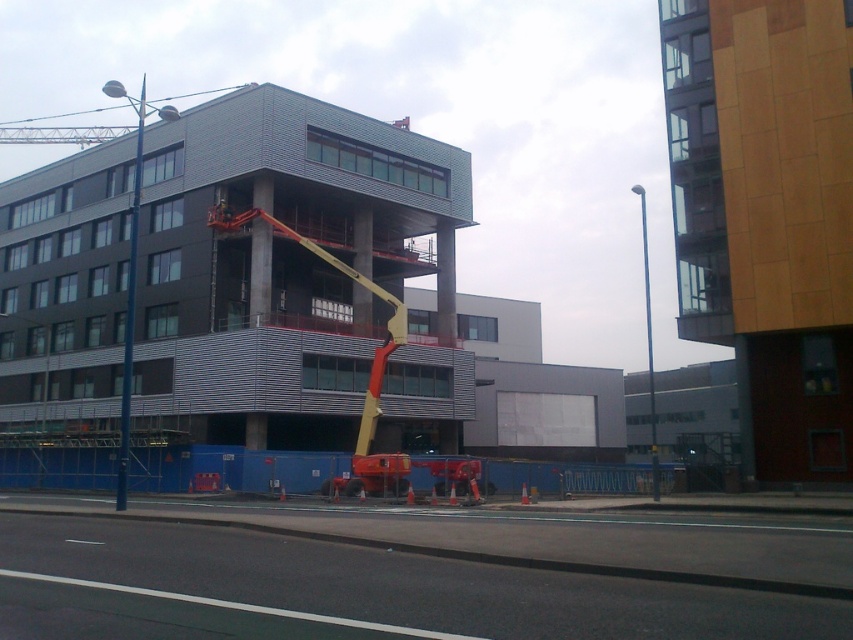
Which is behind, point (126, 428) or point (653, 458)?

Positioned behind is point (653, 458).

Is blue metallic pole at left below smooth metallic pole at center?

No.

Who is more distant from viewer, (140, 108) or (637, 188)?

The point (637, 188) is behind.

At what (x,y) coordinates should I click in order to perform the action: click on blue metallic pole at left. Please return your answer as a coordinate pair (x, y). Looking at the image, I should click on (129, 289).

Who is more distant from viewer, (125,376) or (228,221)?

Positioned behind is point (228,221).

Is blue metallic pole at left smaller than yellow fabric construction worker at center?

Actually, blue metallic pole at left might be larger than yellow fabric construction worker at center.

The width and height of the screenshot is (853, 640). In order to click on blue metallic pole at left in this screenshot , I will do `click(129, 289)`.

Which is in front, point (119, 493) or point (53, 141)?

Point (119, 493) is in front.

Where is `blue metallic pole at left`? blue metallic pole at left is located at coordinates (129, 289).

Between point (138, 202) and point (22, 134), which one is positioned behind?

The point (22, 134) is behind.

Locate an element on the screen. blue metallic pole at left is located at coordinates (129, 289).